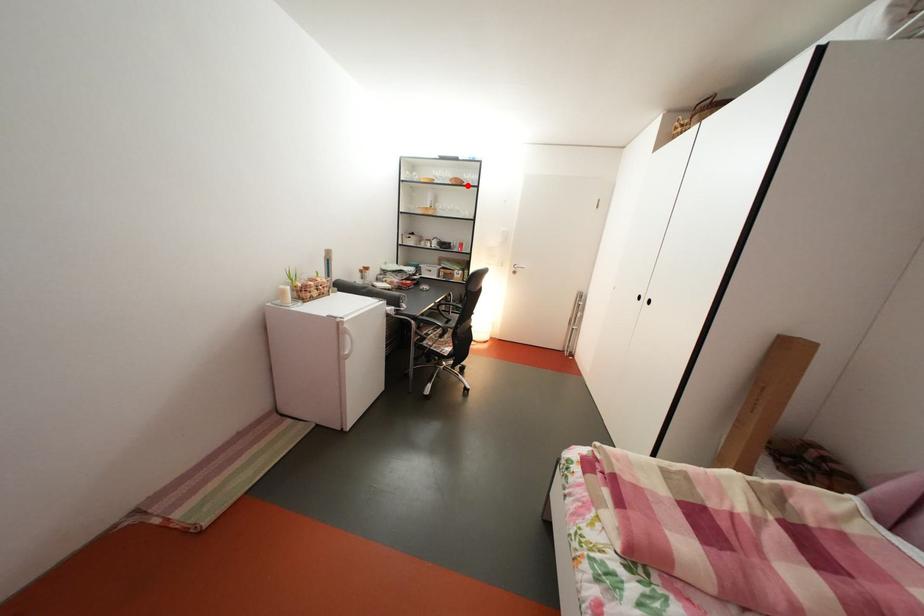
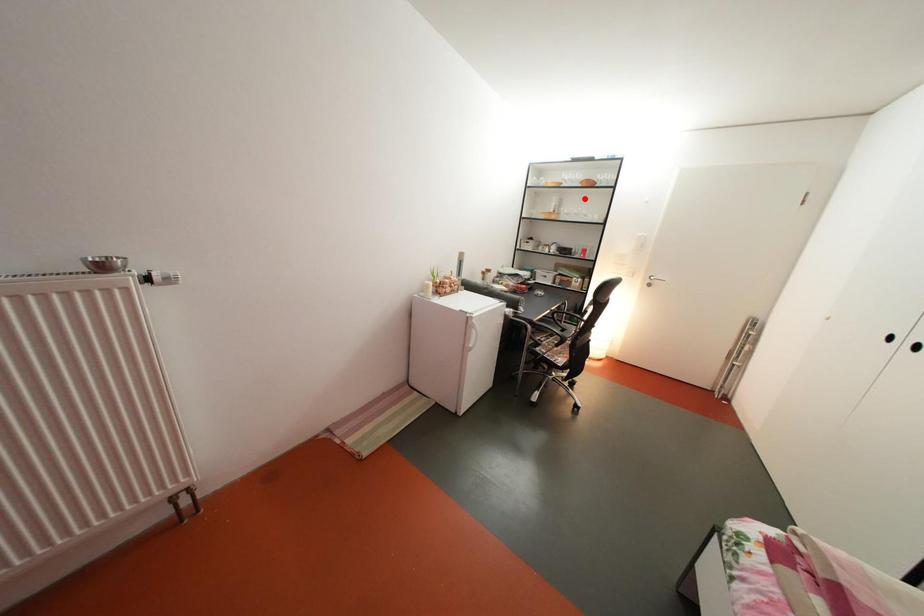
I am providing you with two images of the same scene from different viewpoints. A red point is marked on the first image and another point is marked on the second image. Is the marked point in image1 the same physical position as the marked point in image2?

No